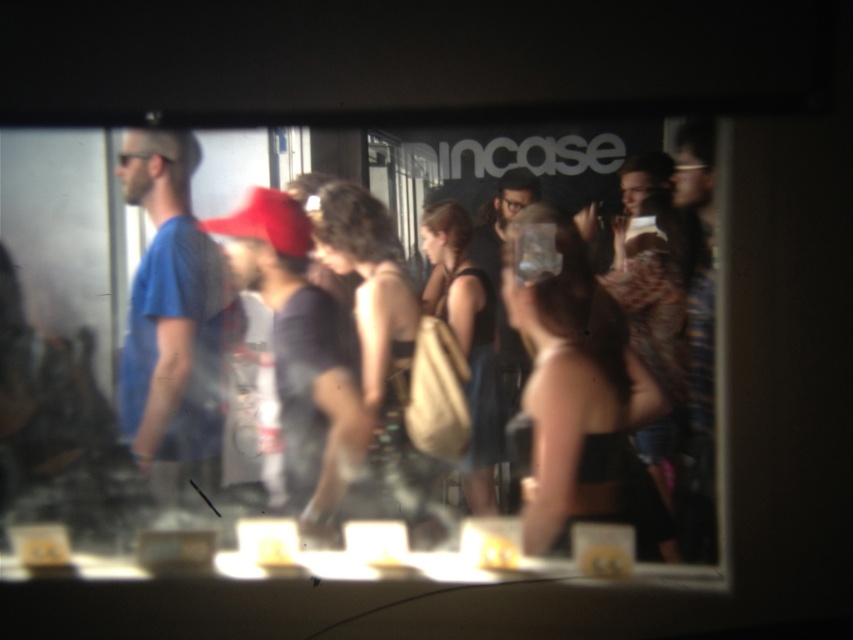
Question: Is transparent glass at center above blue cotton t-shirt at center?

Choices:
 (A) no
 (B) yes

Answer: (A)

Question: From the image, what is the correct spatial relationship of transparent glass at center in relation to blue cotton t-shirt at center?

Choices:
 (A) left
 (B) right

Answer: (B)

Question: Which point appears closest to the camera in this image?

Choices:
 (A) (460, 250)
 (B) (148, 136)

Answer: (B)

Question: Can you confirm if transparent glass at center is positioned above blue cotton t-shirt at center?

Choices:
 (A) yes
 (B) no

Answer: (B)

Question: Which point is closer to the camera?

Choices:
 (A) transparent glass at center
 (B) blue cotton t-shirt at center

Answer: (A)